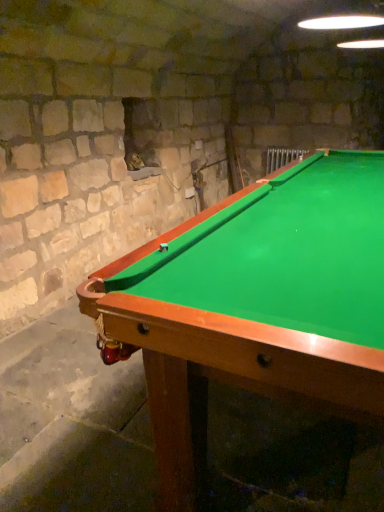
What do you see at coordinates (256, 305) in the screenshot?
I see `green felt pool table at center` at bounding box center [256, 305].

What are the coordinates of `green felt pool table at center` in the screenshot? It's located at (256, 305).

Locate an element on the screen. green felt pool table at center is located at coordinates (256, 305).